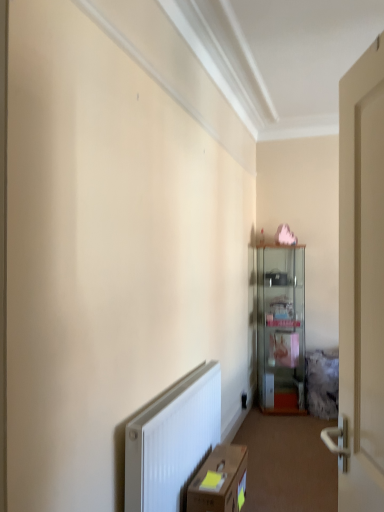
Question: Considering the positions of brown cardboard box at lower center and clear glass cabinet at center in the image, is brown cardboard box at lower center bigger or smaller than clear glass cabinet at center?

Choices:
 (A) big
 (B) small

Answer: (B)

Question: Looking at their shapes, would you say brown cardboard box at lower center is wider or thinner than clear glass cabinet at center?

Choices:
 (A) wide
 (B) thin

Answer: (B)

Question: Considering the positions of point (210, 456) and point (279, 313), is point (210, 456) closer or farther from the camera than point (279, 313)?

Choices:
 (A) closer
 (B) farther

Answer: (A)

Question: From the image's perspective, is clear glass cabinet at center positioned above or below brown cardboard box at lower center?

Choices:
 (A) above
 (B) below

Answer: (A)

Question: Is clear glass cabinet at center wider or thinner than brown cardboard box at lower center?

Choices:
 (A) thin
 (B) wide

Answer: (B)

Question: Choose the correct answer: Is clear glass cabinet at center inside brown cardboard box at lower center or outside it?

Choices:
 (A) outside
 (B) inside

Answer: (A)

Question: In terms of size, does clear glass cabinet at center appear bigger or smaller than brown cardboard box at lower center?

Choices:
 (A) big
 (B) small

Answer: (A)